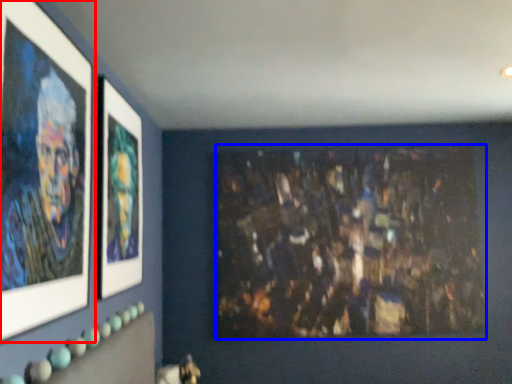
Question: Among these objects, which one is nearest to the camera, picture frame (highlighted by a red box) or art (highlighted by a blue box)?

Choices:
 (A) picture frame
 (B) art

Answer: (A)